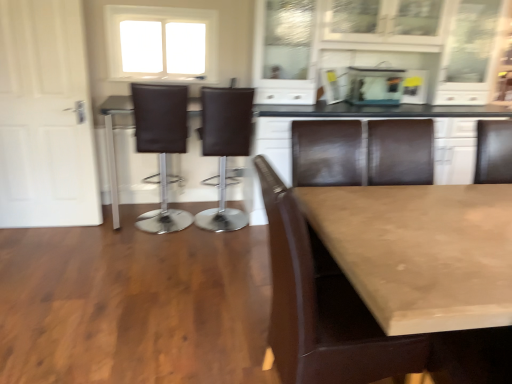
What are the coordinates of `vacant area in front of brown leather chair at center, which appears as the 3th chair when viewed from the front` in the screenshot? It's located at (216, 249).